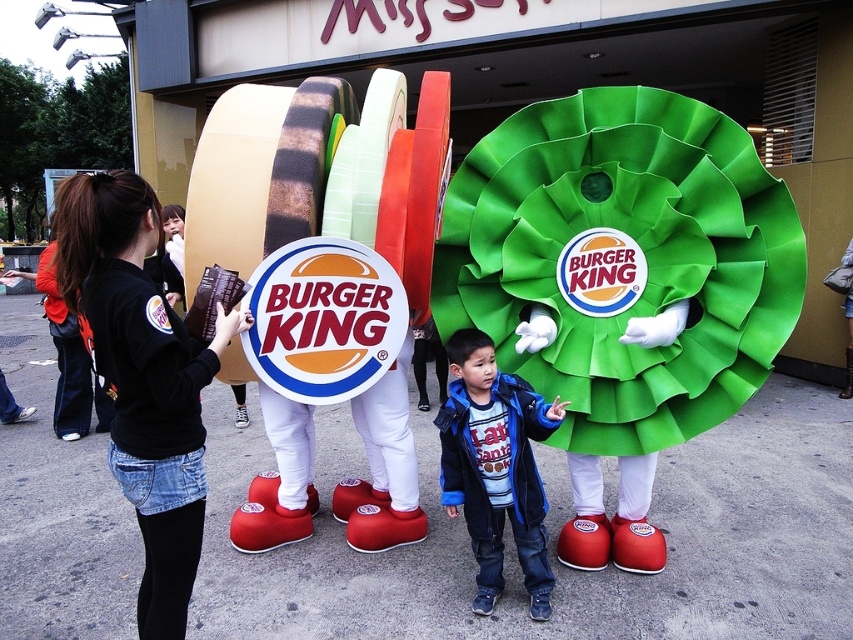
Question: Can you confirm if black fabric jacket at left is wider than blue fleece jacket at center?

Choices:
 (A) yes
 (B) no

Answer: (A)

Question: Which point is closer to the camera taking this photo?

Choices:
 (A) (531, 484)
 (B) (206, 346)

Answer: (B)

Question: Observing the image, what is the correct spatial positioning of black fabric jacket at left in reference to blue fleece jacket at center?

Choices:
 (A) above
 (B) below

Answer: (A)

Question: Which point is farther to the camera?

Choices:
 (A) black fabric jacket at left
 (B) blue fleece jacket at center

Answer: (B)

Question: Does black fabric jacket at left have a lesser width compared to blue fleece jacket at center?

Choices:
 (A) no
 (B) yes

Answer: (A)